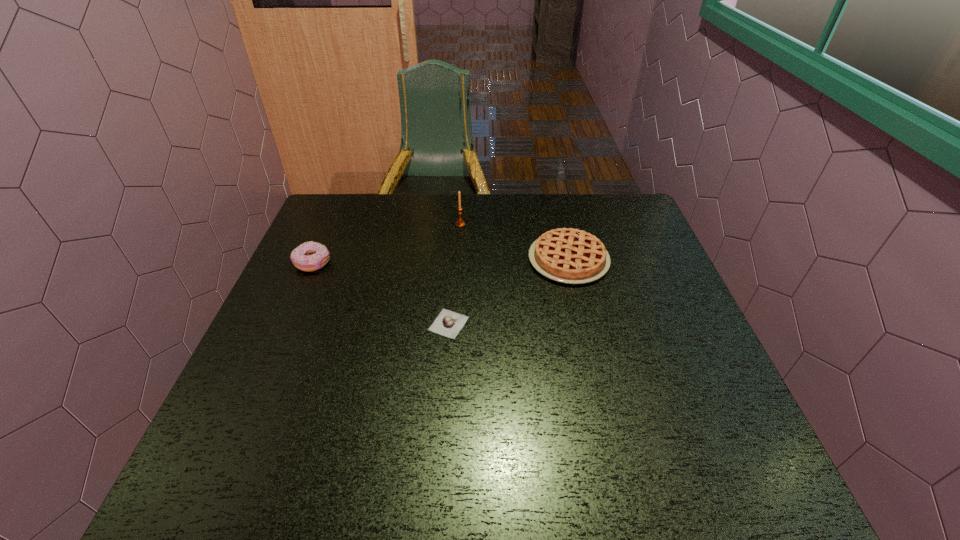
Identify the location of the tallest object. The height and width of the screenshot is (540, 960). (460, 223).

Image resolution: width=960 pixels, height=540 pixels. I want to click on candle_holder, so click(x=460, y=223).

What are the coordinates of `doughnut` in the screenshot? It's located at (310, 256).

Image resolution: width=960 pixels, height=540 pixels. In order to click on the rightmost object in this screenshot , I will do `click(567, 255)`.

Where is `the second shortest object`? the second shortest object is located at coordinates (567, 255).

Find the location of `garlic`. garlic is located at coordinates click(x=448, y=323).

Image resolution: width=960 pixels, height=540 pixels. I want to click on the shortest object, so click(x=448, y=323).

You are a GUI agent. You are given a task and a screenshot of the screen. Output one action in this format:
    pyautogui.click(x=<x>, y=<y>)
    Task: Click on the vacant area located on the front of the tallest object
    
    Given the screenshot: What is the action you would take?
    pyautogui.click(x=459, y=243)

Where is `free space located on the right of the doughnut`? The height and width of the screenshot is (540, 960). free space located on the right of the doughnut is located at coordinates (396, 264).

This screenshot has height=540, width=960. I want to click on vacant area situated on the left of the pie, so click(x=422, y=260).